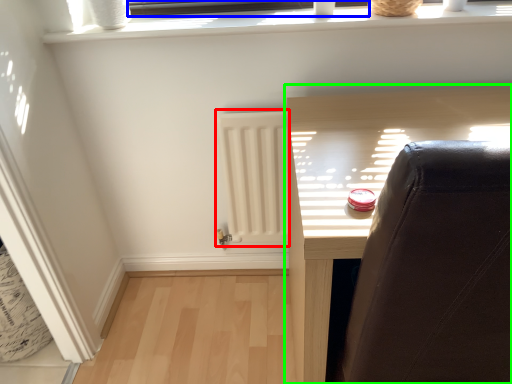
Question: Considering the real-world distances, which object is farthest from radiator (highlighted by a red box)? window frame (highlighted by a blue box) or furniture (highlighted by a green box)?

Choices:
 (A) window frame
 (B) furniture

Answer: (A)